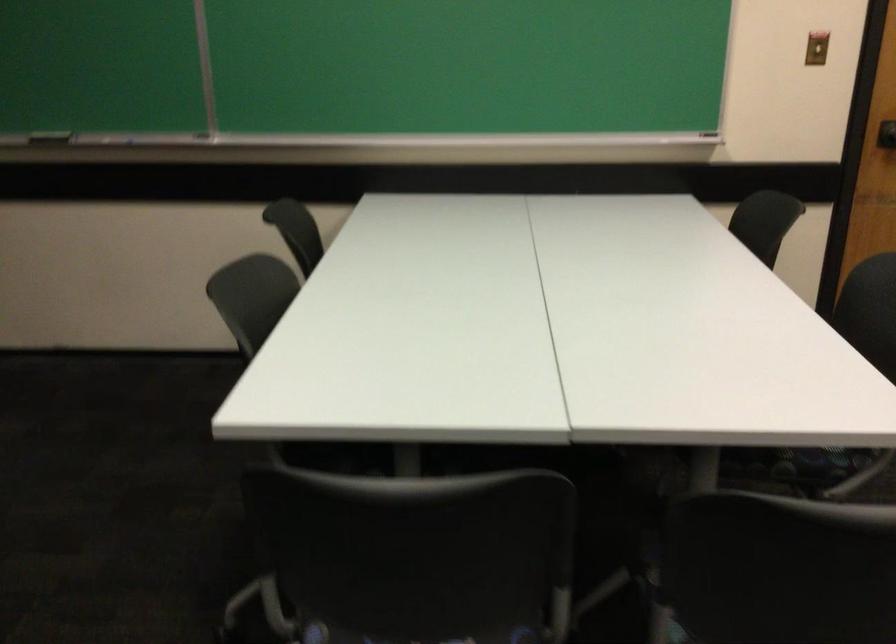
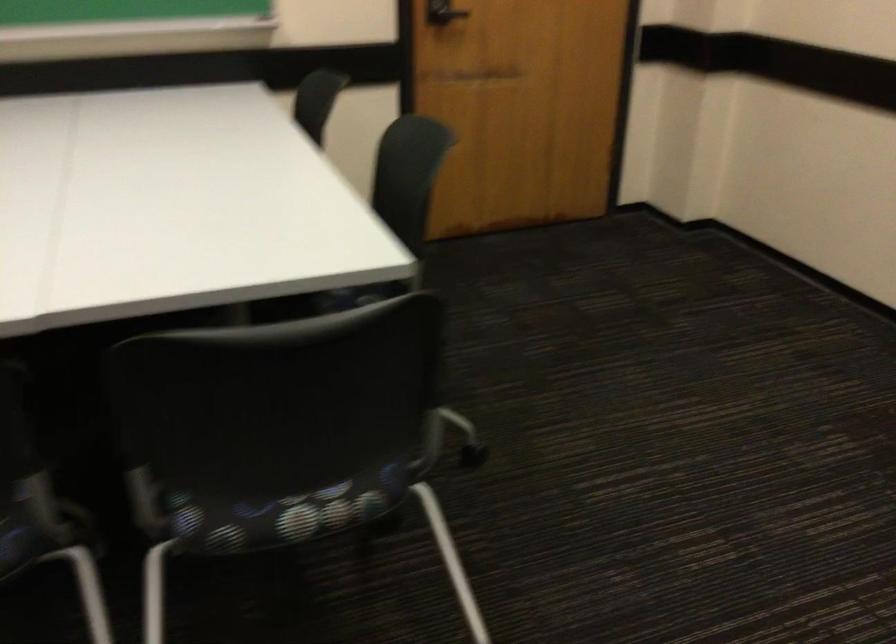
Question: Which direction would the cameraman need to move to produce the second image? Reply with the corresponding letter.

Choices:
 (A) Left
 (B) Right
 (C) Forward
 (D) Backward

Answer: (B)